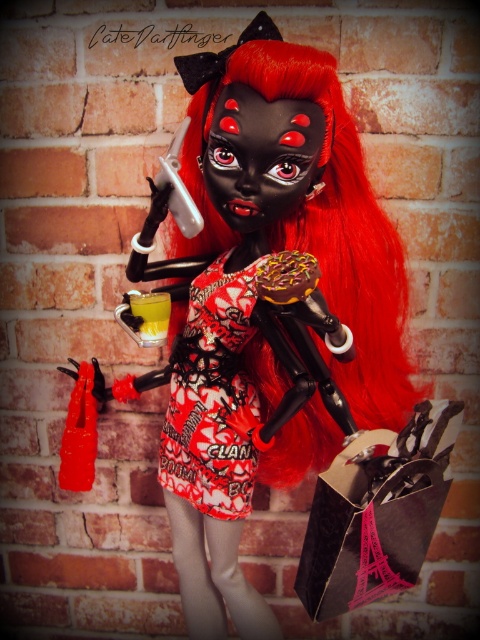
Does printed fabric dress at center have a larger size compared to yellow translucent liquid at center?

Correct, printed fabric dress at center is larger in size than yellow translucent liquid at center.

Who is taller, printed fabric dress at center or yellow translucent liquid at center?

Standing taller between the two is printed fabric dress at center.

Who is more distant from viewer, (262, 260) or (152, 320)?

Point (262, 260)

Locate an element on the screen. printed fabric dress at center is located at coordinates (213, 397).

Can you confirm if black paper shopping bag at lower right is positioned below printed fabric dress at center?

Indeed, black paper shopping bag at lower right is positioned under printed fabric dress at center.

Can you confirm if black paper shopping bag at lower right is thinner than printed fabric dress at center?

In fact, black paper shopping bag at lower right might be wider than printed fabric dress at center.

Which is behind, point (368, 563) or point (220, 490)?

Positioned behind is point (220, 490).

The height and width of the screenshot is (640, 480). Find the location of `black paper shopping bag at lower right`. black paper shopping bag at lower right is located at coordinates coord(376,513).

Does black paper shopping bag at lower right have a lesser height compared to yellow translucent liquid at center?

In fact, black paper shopping bag at lower right may be taller than yellow translucent liquid at center.

Based on the photo, which of these two, black paper shopping bag at lower right or yellow translucent liquid at center, stands shorter?

yellow translucent liquid at center

This screenshot has height=640, width=480. I want to click on black paper shopping bag at lower right, so click(x=376, y=513).